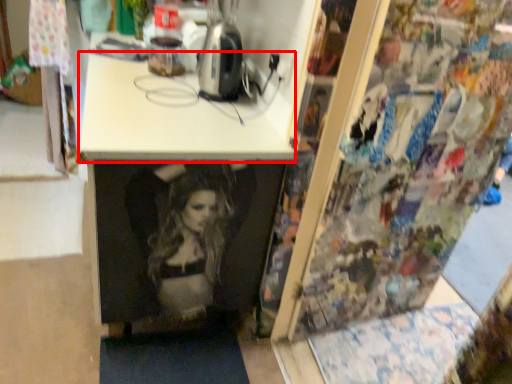
Question: In this image, where is counter top (annotated by the red box) located relative to appliance?

Choices:
 (A) right
 (B) left

Answer: (B)